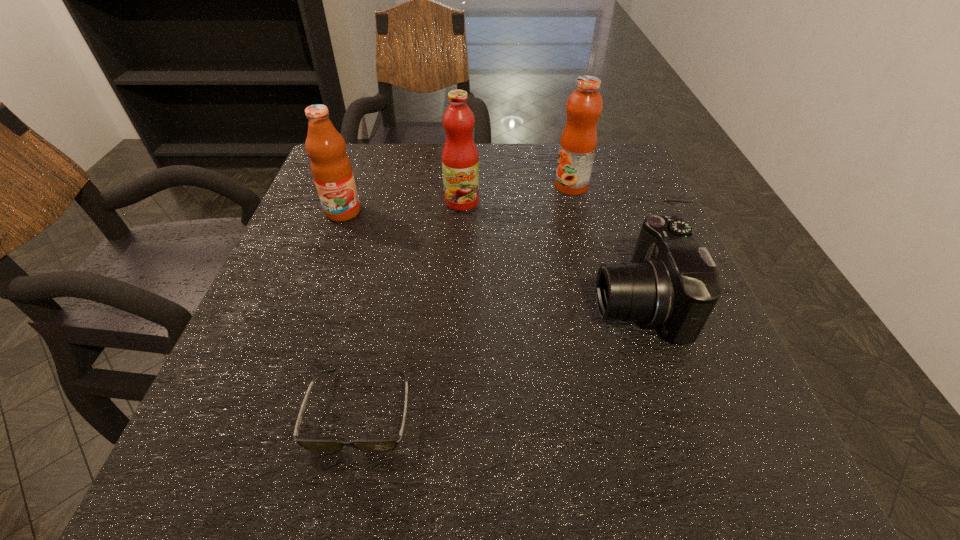
At what (x,y) coordinates should I click in order to perform the action: click on vacant space that is in between the leftmost object and the second fruit juice from left to right. Please return your answer as a coordinate pair (x, y). The height and width of the screenshot is (540, 960). Looking at the image, I should click on (402, 207).

At what (x,y) coordinates should I click in order to perform the action: click on free spot between the leftmost fruit juice and the third object from right to left. Please return your answer as a coordinate pair (x, y). The width and height of the screenshot is (960, 540). Looking at the image, I should click on (402, 207).

The height and width of the screenshot is (540, 960). I want to click on unoccupied area between the leftmost object and the camera, so click(x=490, y=257).

Image resolution: width=960 pixels, height=540 pixels. I want to click on unoccupied area between the second fruit juice from left to right and the second shortest object, so click(x=549, y=252).

Locate an element on the screen. This screenshot has width=960, height=540. vacant region between the camera and the rightmost fruit juice is located at coordinates (604, 244).

Locate an element on the screen. The height and width of the screenshot is (540, 960). free space between the shortest object and the camera is located at coordinates (498, 356).

Locate an element on the screen. The height and width of the screenshot is (540, 960). vacant space in between the third object from right to left and the shortest object is located at coordinates (411, 306).

Locate an element on the screen. vacant region between the camera and the leftmost fruit juice is located at coordinates (490, 257).

The image size is (960, 540). In order to click on free area in between the shortest object and the rightmost fruit juice in this screenshot , I will do `click(466, 298)`.

Select which object is the fourth closest to the rightmost fruit juice. Please provide its 2D coordinates. Your answer should be formatted as a tuple, i.e. [(x, y)], where the tuple contains the x and y coordinates of a point satisfying the conditions above.

[(388, 444)]